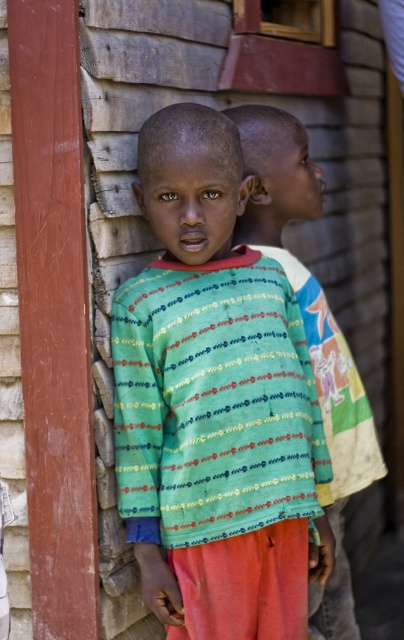
You are a photographer trying to capture a clear shot of both children. The first child is at point [162,540] and the second child is at point [273,118]. Which child should you focus on first to ensure both are in focus?

You should focus on the child at point [162,540] first because it is closer to the viewer. Since it is closer, focusing on this child will help ensure the other child further away at point [273,118] is also within the depth of field.

You are a photographer trying to capture both children in a single shot. The camera frame can only accommodate the width of the multicolored fabric shirt at center. Will the multicolored printed shirt at center fit within the frame?

The multicolored printed shirt at center is wider than the multicolored fabric shirt at center. Since the camera frame can only fit the width of the multicolored fabric shirt at center, the multicolored printed shirt at center will not fit within the frame.

You are a photographer trying to capture the multicolored printed shirt at center in the image. The camera is set to focus on the point at coordinates point (214, 403). Is this point likely to be on the multicolored printed shirt at center?

Yes, the point (214, 403) marks the multicolored printed shirt at center, so the focus will be on it.